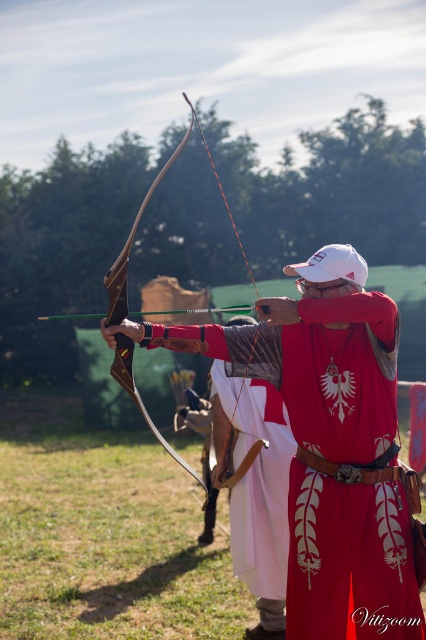
Does leather bow at center have a greater height compared to wooden bow at center?

No, leather bow at center is not taller than wooden bow at center.

Can you confirm if leather bow at center is bigger than wooden bow at center?

Incorrect, leather bow at center is not larger than wooden bow at center.

Locate an element on the screen. This screenshot has width=426, height=640. leather bow at center is located at coordinates (328, 444).

I want to click on leather bow at center, so click(328, 444).